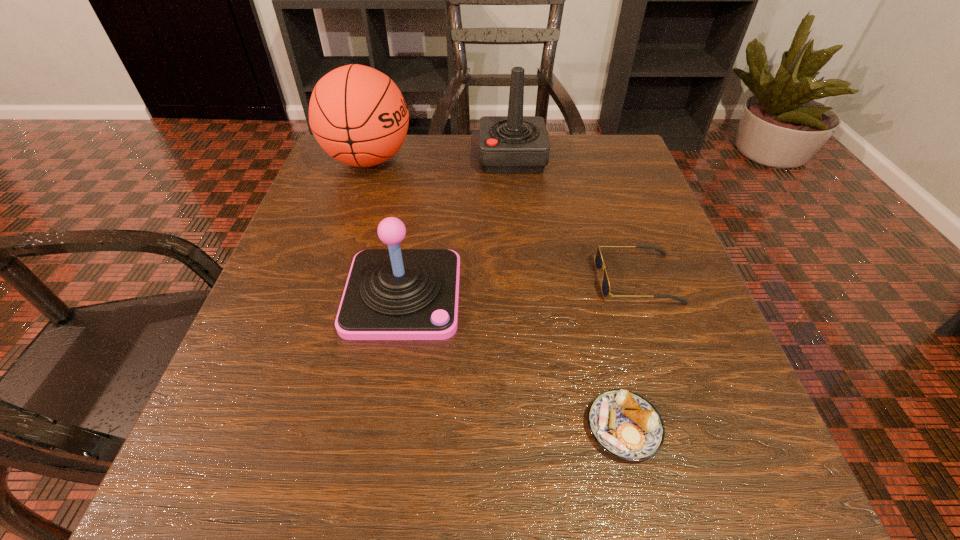
The image size is (960, 540). I want to click on basketball located at the left edge, so click(x=358, y=115).

The image size is (960, 540). I want to click on joystick located at the left edge, so click(391, 294).

Locate an element on the screen. This screenshot has height=540, width=960. sunglasses that is at the right edge is located at coordinates (598, 261).

The height and width of the screenshot is (540, 960). What are the coordinates of `pastry that is positioned at the right edge` in the screenshot? It's located at (624, 424).

Where is `object positioned at the far left corner`? object positioned at the far left corner is located at coordinates (358, 115).

Identify the location of object positioned at the near right corner. (624, 424).

The image size is (960, 540). Find the location of `free space at the far edge of the desktop`. free space at the far edge of the desktop is located at coordinates (543, 184).

In the image, there is a desktop. Identify the location of vacant space at the near edge. The image size is (960, 540). (416, 458).

Locate an element on the screen. vacant region at the left edge of the desktop is located at coordinates (275, 272).

Where is `blank area at the right edge`? The width and height of the screenshot is (960, 540). blank area at the right edge is located at coordinates (667, 271).